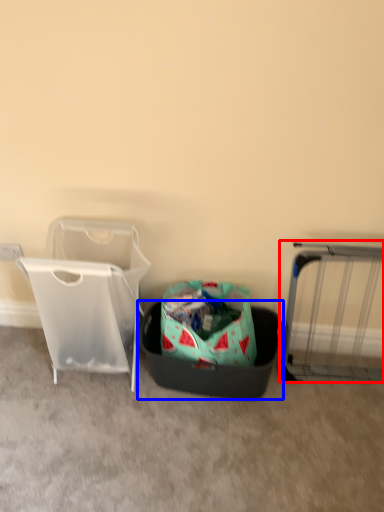
Question: Among these objects, which one is nearest to the camera, furniture (highlighted by a red box) or laundry basket (highlighted by a blue box)?

Choices:
 (A) furniture
 (B) laundry basket

Answer: (A)